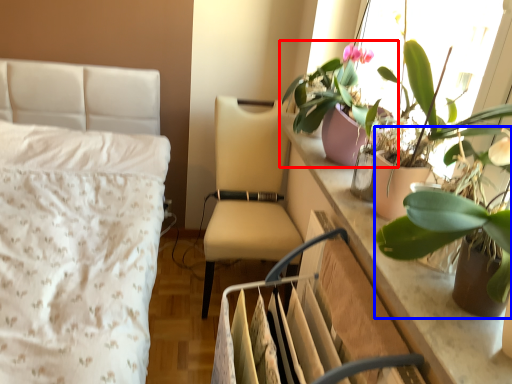
Question: Among these objects, which one is farthest to the camera, houseplant (highlighted by a red box) or houseplant (highlighted by a blue box)?

Choices:
 (A) houseplant
 (B) houseplant

Answer: (A)